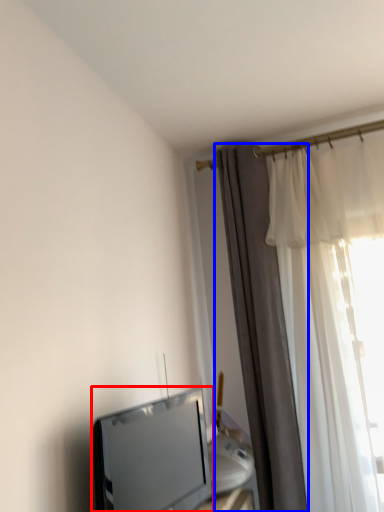
Question: Which of the following is the farthest to the observer, television (highlighted by a red box) or curtain (highlighted by a blue box)?

Choices:
 (A) television
 (B) curtain

Answer: (B)